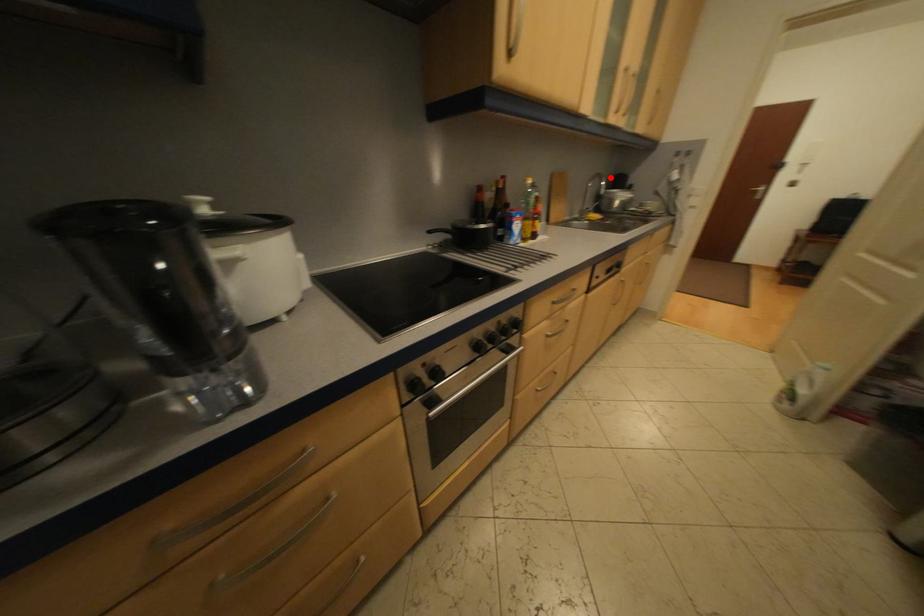
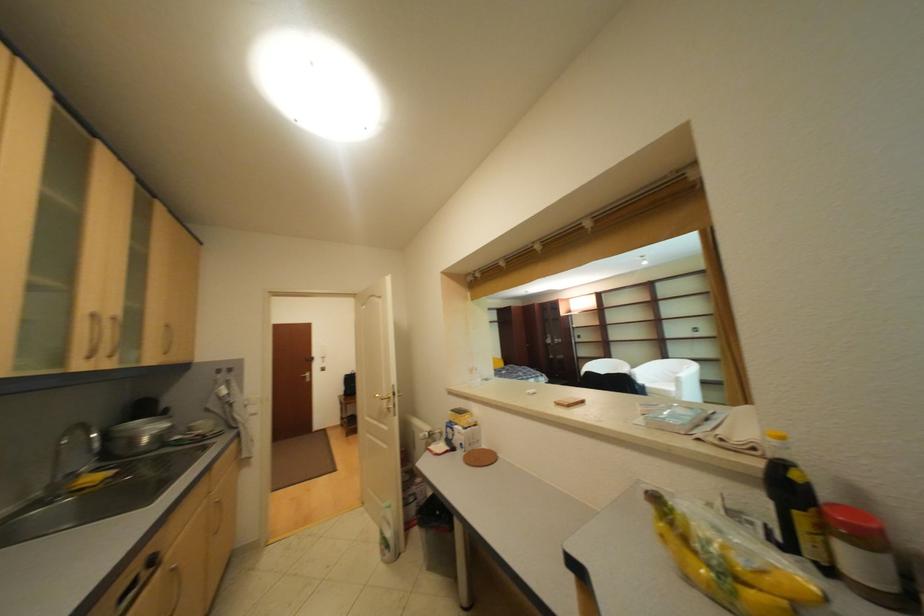
Question: I am providing you with two images of the same scene from different viewpoints. Image1 has a red point marked. In image2, the corresponding 3D location appears at what relative position? Reply with the corresponding letter.

Choices:
 (A) Closer
 (B) Farther

Answer: (B)